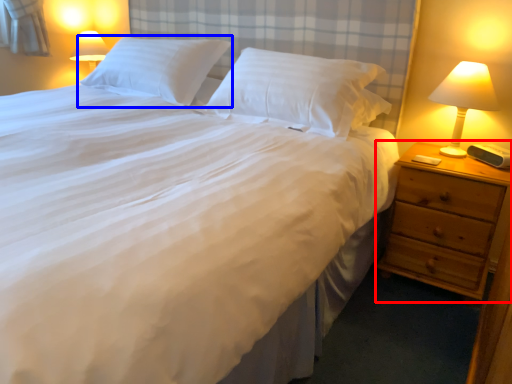
Question: Which object is closer to the camera taking this photo, nightstand (highlighted by a red box) or pillow (highlighted by a blue box)?

Choices:
 (A) nightstand
 (B) pillow

Answer: (A)